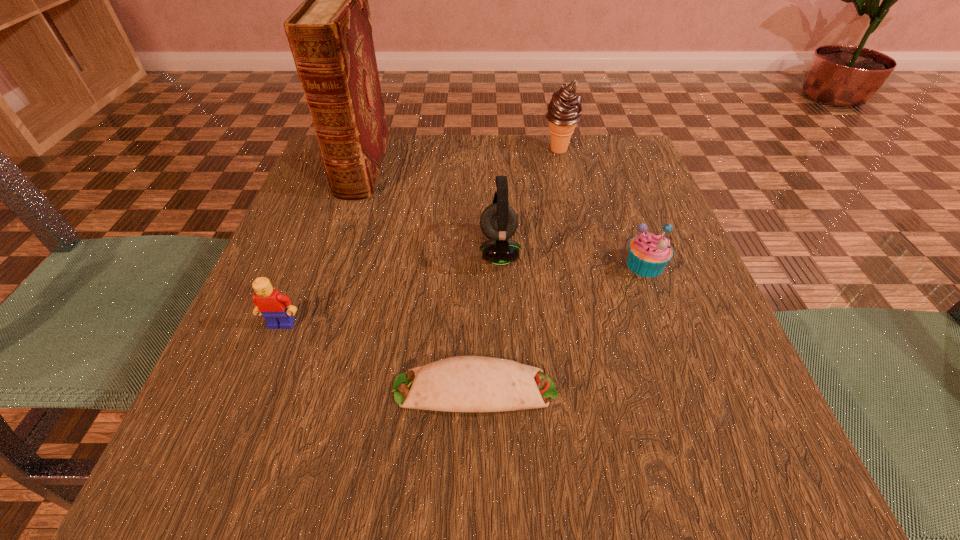
Locate which object ranks third in proximity to the hardback book. Please provide its 2D coordinates. Your answer should be formatted as a tuple, i.e. [(x, y)], where the tuple contains the x and y coordinates of a point satisfying the conditions above.

[(564, 110)]

Choose which object is the third nearest neighbor to the muffin. Please provide its 2D coordinates. Your answer should be formatted as a tuple, i.e. [(x, y)], where the tuple contains the x and y coordinates of a point satisfying the conditions above.

[(564, 110)]

This screenshot has height=540, width=960. I want to click on free space that satisfies the following two spatial constraints: 1. on the ear cups of the rightmost object; 2. on the left side of the fourth shortest object, so click(499, 265).